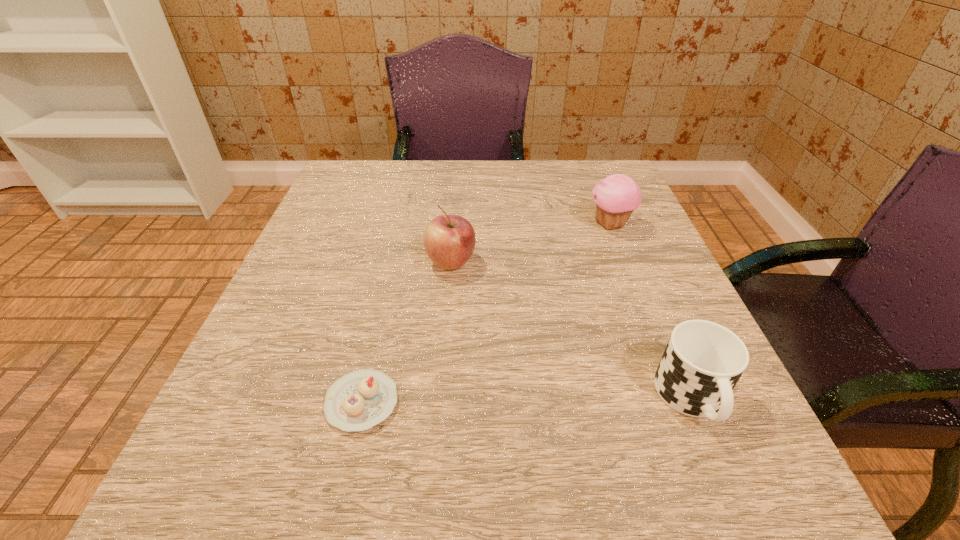
In order to click on vacant point located on the back of the nearer cupcake in this screenshot , I will do `click(390, 284)`.

I want to click on object at the left edge, so click(x=359, y=400).

Identify the location of cupcake that is positioned at the right edge. (617, 196).

Locate an element on the screen. cup positioned at the right edge is located at coordinates (703, 361).

This screenshot has height=540, width=960. I want to click on vacant region at the far edge of the desktop, so click(476, 182).

Locate an element on the screen. Image resolution: width=960 pixels, height=540 pixels. vacant space at the near edge of the desktop is located at coordinates (478, 463).

Identify the location of vacant space at the left edge. The width and height of the screenshot is (960, 540). (260, 400).

The image size is (960, 540). Find the location of `vacant space at the right edge of the desktop`. vacant space at the right edge of the desktop is located at coordinates pyautogui.click(x=617, y=352).

Find the location of a particular element. The height and width of the screenshot is (540, 960). blank space at the far left corner is located at coordinates (375, 165).

In the image, there is a desktop. Where is `vacant space at the near left corner`? The image size is (960, 540). vacant space at the near left corner is located at coordinates (294, 492).